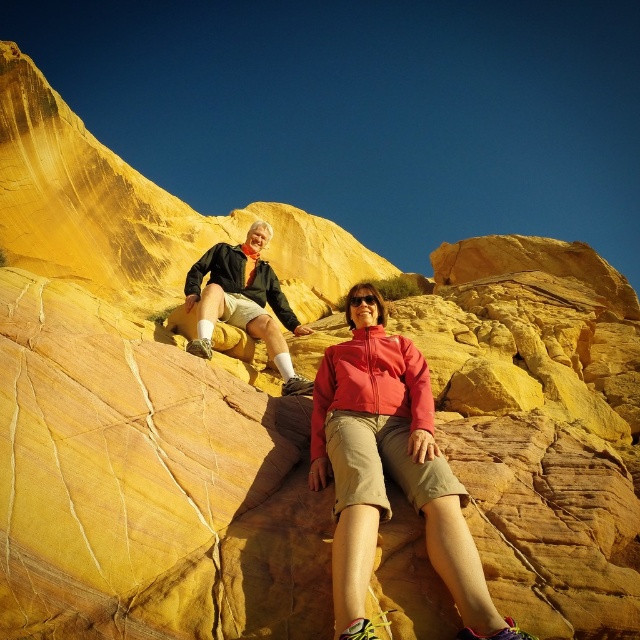
Question: Is matte pink jacket at center further to the viewer compared to matte black jacket at upper left?

Choices:
 (A) no
 (B) yes

Answer: (A)

Question: Is matte pink jacket at center bigger than matte black jacket at upper left?

Choices:
 (A) yes
 (B) no

Answer: (A)

Question: Among these objects, which one is farthest from the camera?

Choices:
 (A) matte black jacket at upper left
 (B) matte pink jacket at center

Answer: (A)

Question: Observing the image, what is the correct spatial positioning of matte pink jacket at center in reference to matte black jacket at upper left?

Choices:
 (A) left
 (B) right

Answer: (B)

Question: Which point appears farthest from the camera in this image?

Choices:
 (A) (369, 556)
 (B) (234, 253)

Answer: (B)